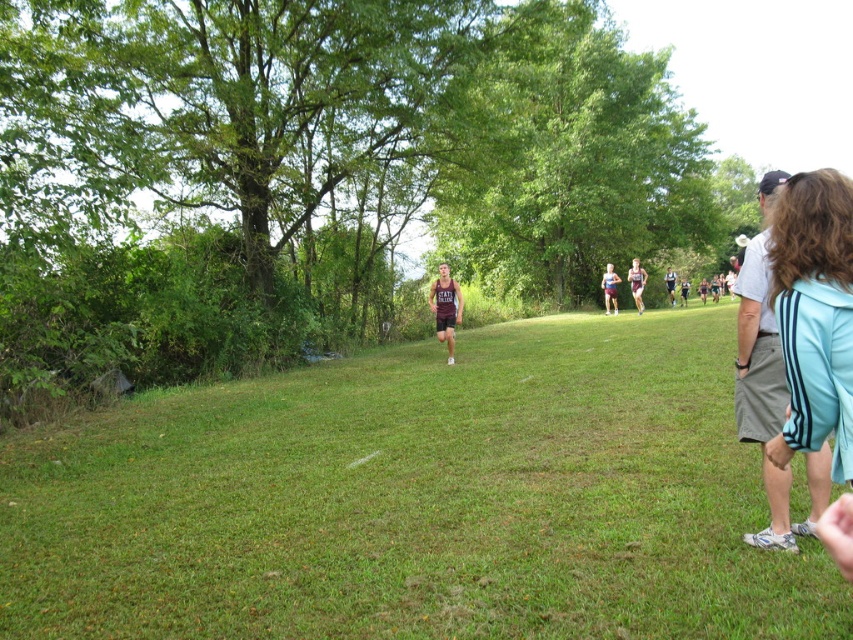
Question: Considering the real-world distances, which object is closest to the green leafy tree at center?

Choices:
 (A) maroon jersey at center
 (B) green grassy field at center
 (C) white cotton shirt at right
 (D) dark brown athletic shorts at center

Answer: (D)

Question: Is green leafy tree at center wider than white cotton shirt at right?

Choices:
 (A) no
 (B) yes

Answer: (B)

Question: Which object is closer to the camera taking this photo?

Choices:
 (A) white cotton shirt at right
 (B) maroon jersey at center
 (C) dark brown athletic shorts at center

Answer: (A)

Question: Which is nearer to the dark brown athletic shorts at center?

Choices:
 (A) green grassy field at center
 (B) white cotton shirt at right

Answer: (A)

Question: Is green leafy tree at center positioned before maroon jersey at center?

Choices:
 (A) yes
 (B) no

Answer: (B)

Question: Does green leafy tree at center appear on the left side of white cotton shirt at right?

Choices:
 (A) no
 (B) yes

Answer: (A)